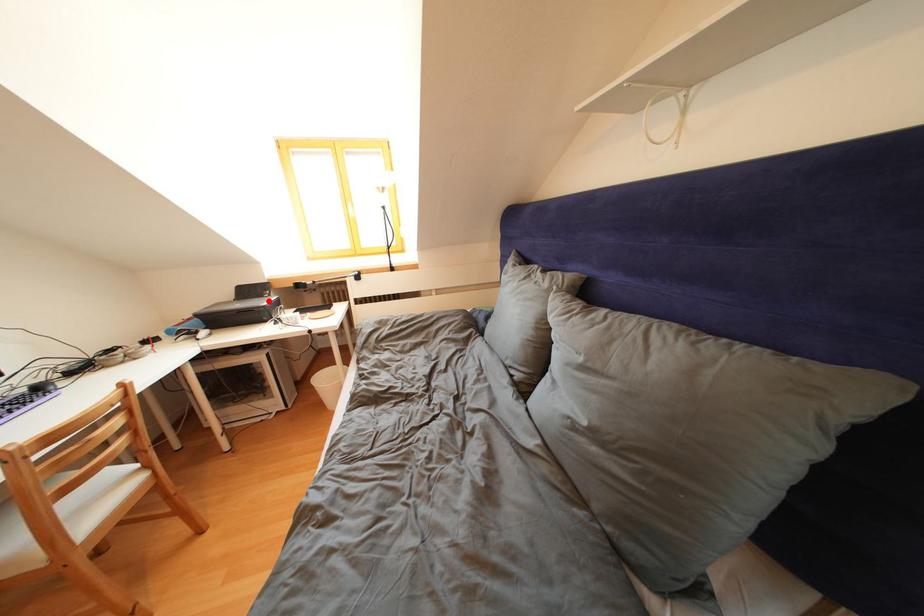
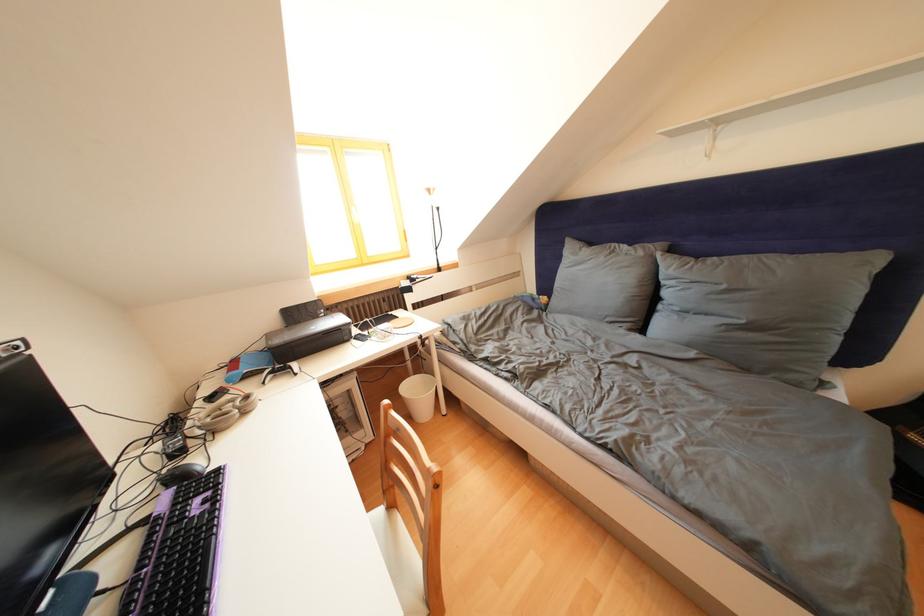
Locate, in the second image, the point that corresponds to the highlighted location in the first image.

(323, 322)